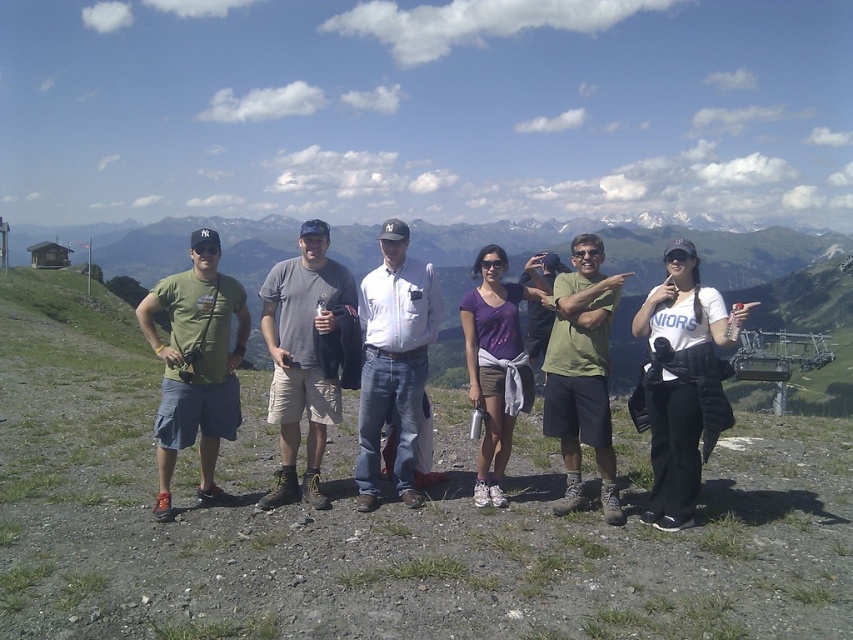
Is white matte shirt at center shorter than white cotton shirt at center?

Yes.

Based on the photo, can you confirm if white matte shirt at center is wider than white cotton shirt at center?

Correct, the width of white matte shirt at center exceeds that of white cotton shirt at center.

Who is more distant from viewer, (659, 355) or (399, 356)?

The point (399, 356) is behind.

The width and height of the screenshot is (853, 640). In order to click on white matte shirt at center in this screenshot , I will do `click(682, 381)`.

Which is below, white matte shirt at center or gray fabric shirt at center?

gray fabric shirt at center is lower down.

Can you confirm if white matte shirt at center is bigger than gray fabric shirt at center?

Yes, white matte shirt at center is bigger than gray fabric shirt at center.

This screenshot has height=640, width=853. What do you see at coordinates (682, 381) in the screenshot? I see `white matte shirt at center` at bounding box center [682, 381].

The image size is (853, 640). What are the coordinates of `white matte shirt at center` in the screenshot? It's located at (682, 381).

Who is positioned more to the right, gray fabric shirt at center or green matte shorts at center?

green matte shorts at center

Is point (279, 282) positioned before point (598, 353)?

No.

Where is `gray fabric shirt at center`? This screenshot has width=853, height=640. gray fabric shirt at center is located at coordinates (302, 356).